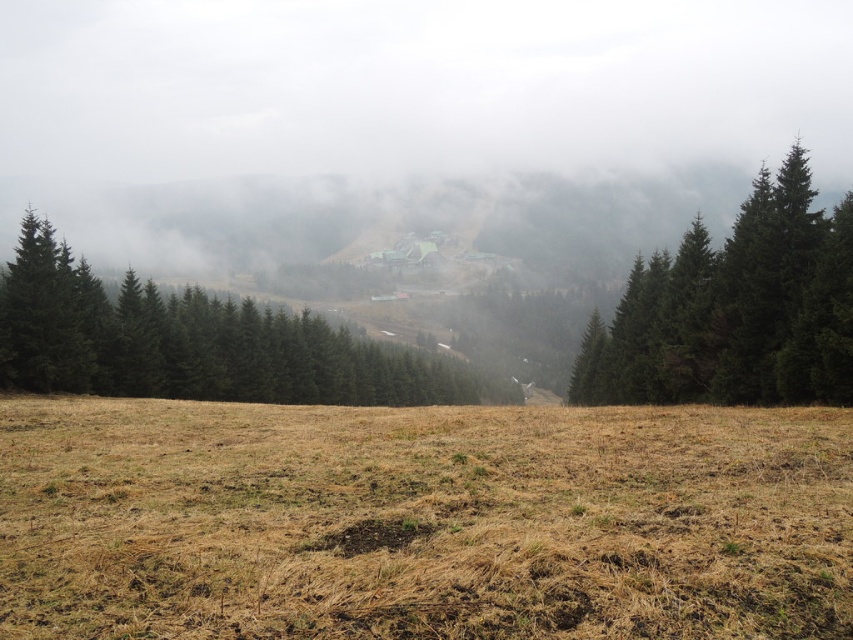
In the scene shown: You are an environmental scientist studying the landscape. You observe the brown grass at center and the dark green textured tree at right. Which object occupies a larger horizontal space in the image?

The brown grass at center has a greater width than the dark green textured tree at right, so it occupies a larger horizontal space in the image.

You are an environmental scientist assessing the landscape. You need to determine which area has a wider spread of vegetation between the green matte trees at center and the dark green textured tree at right. Which one has a larger width?

The green matte trees at center has a larger width than the dark green textured tree at right according to the description.

Based on the photo, you are an environmental researcher studying the landscape. You observe the green matte trees at center and the dark green textured tree at right. Which of these two trees is positioned closer to the ground level?

The green matte trees at center is positioned closer to the ground level because it is described as being below the dark green textured tree at right.